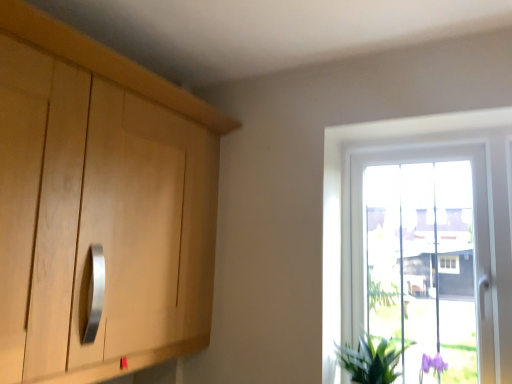
Question: From the image's perspective, is transparent glass window at right under green leafy plant at lower right?

Choices:
 (A) no
 (B) yes

Answer: (A)

Question: Can you confirm if transparent glass window at right is positioned to the right of green leafy plant at lower right?

Choices:
 (A) yes
 (B) no

Answer: (A)

Question: Is green leafy plant at lower right inside transparent glass window at right?

Choices:
 (A) no
 (B) yes

Answer: (A)

Question: Does transparent glass window at right have a larger size compared to green leafy plant at lower right?

Choices:
 (A) no
 (B) yes

Answer: (B)

Question: Does transparent glass window at right have a lesser width compared to green leafy plant at lower right?

Choices:
 (A) yes
 (B) no

Answer: (A)

Question: Considering the relative positions of transparent glass window at right and green leafy plant at lower right in the image provided, is transparent glass window at right behind green leafy plant at lower right?

Choices:
 (A) yes
 (B) no

Answer: (A)

Question: Is green leafy plant at lower right at the right side of transparent glass window at right?

Choices:
 (A) yes
 (B) no

Answer: (B)

Question: Is transparent glass window at right at the back of green leafy plant at lower right?

Choices:
 (A) no
 (B) yes

Answer: (B)

Question: Can you confirm if green leafy plant at lower right is smaller than transparent glass window at right?

Choices:
 (A) yes
 (B) no

Answer: (A)

Question: Is the depth of green leafy plant at lower right less than that of transparent glass window at right?

Choices:
 (A) no
 (B) yes

Answer: (B)

Question: Does green leafy plant at lower right turn towards transparent glass window at right?

Choices:
 (A) no
 (B) yes

Answer: (A)

Question: From a real-world perspective, is green leafy plant at lower right on top of transparent glass window at right?

Choices:
 (A) no
 (B) yes

Answer: (A)

Question: Considering the positions of point (361, 147) and point (334, 349), is point (361, 147) closer or farther from the camera than point (334, 349)?

Choices:
 (A) closer
 (B) farther

Answer: (B)